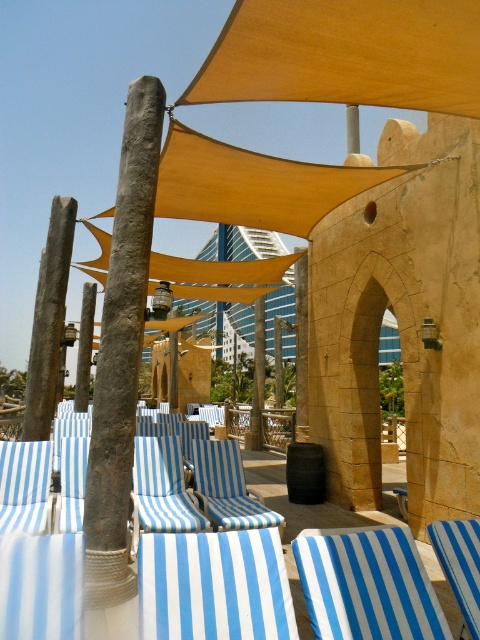
You are planning to hang a decorative banner between the matte yellow fabric canopy at center and the beige stone archway at center. The banner requires 7 feet of space to be displayed properly. Based on the scene, will there be enough space between them to hang the banner?

The matte yellow fabric canopy at center and beige stone archway at center are 8.05 feet apart from each other, which is more than the required 7 feet. Therefore, there is enough space to hang the banner between them.

You are standing in the outdoor seating area and want to take a photo of the beige stone archway at center. However, the matte yellow fabric canopy at center is blocking your view. Can you move the canopy to get a clear shot of the archway?

The matte yellow fabric canopy at center is in front of the beige stone archway at center, so you cannot move the canopy to get a clear shot of the archway without physically relocating the canopy.

You are standing in the outdoor seating area and want to move from the blue striped fabric beach chair at left to the beige stone archway at center. Which direction should you move to get closer to the archway?

To move closer to the beige stone archway at center from the blue striped fabric beach chair at left, you should move forward since the blue striped fabric beach chair at left is behind the beige stone archway at center.